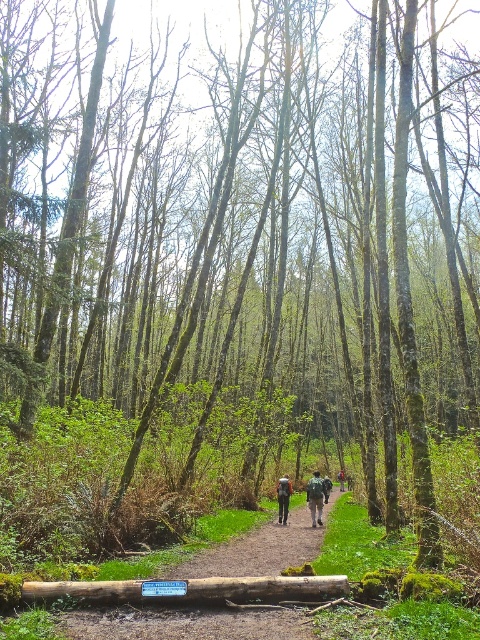
Question: Estimate the real-world distances between objects in this image. Which object is farther from the green fabric backpack at center?

Choices:
 (A) orange fabric backpack at center
 (B) brown rough log at lower center
 (C) matte gray backpacks at center
 (D) camouflage fabric backpack at center

Answer: (B)

Question: Observing the image, what is the correct spatial positioning of brown rough log at lower center in reference to camouflage fabric backpack at center?

Choices:
 (A) left
 (B) right

Answer: (A)

Question: Is matte gray backpacks at center to the right of green fabric backpack at center from the viewer's perspective?

Choices:
 (A) no
 (B) yes

Answer: (A)

Question: Which object is farther from the camera taking this photo?

Choices:
 (A) brown rough log at lower center
 (B) matte gray backpacks at center
 (C) green fabric backpack at center

Answer: (C)

Question: Is camouflage fabric backpack at center to the left of green fabric backpack at center from the viewer's perspective?

Choices:
 (A) yes
 (B) no

Answer: (A)

Question: Which object appears farthest from the camera in this image?

Choices:
 (A) brown rough log at lower center
 (B) green fabric backpack at center

Answer: (B)